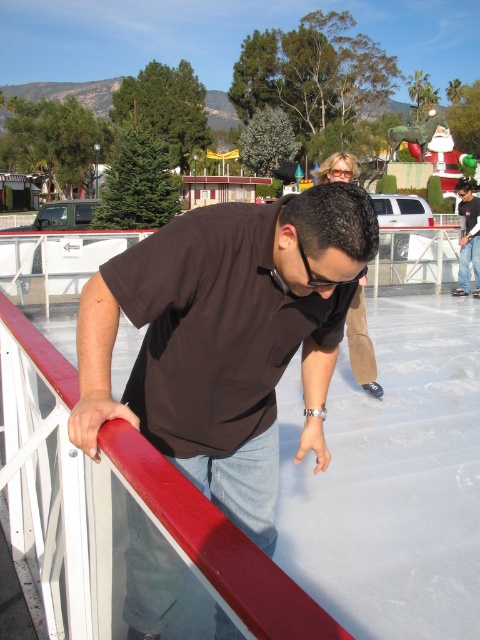
Is point (83, 369) in front of point (464, 244)?

Yes, it is.

The image size is (480, 640). I want to click on matte black shirt at center, so click(x=227, y=339).

Is point (235, 468) less distant than point (467, 237)?

Yes, it is in front of point (467, 237).

Where is `matte black shirt at center`? matte black shirt at center is located at coordinates (227, 339).